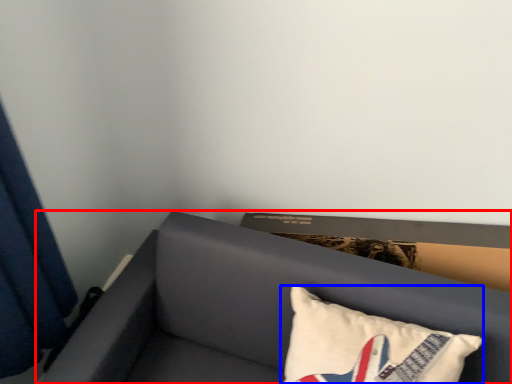
Question: Among these objects, which one is nearest to the camera, furniture (highlighted by a red box) or pillow (highlighted by a blue box)?

Choices:
 (A) furniture
 (B) pillow

Answer: (A)